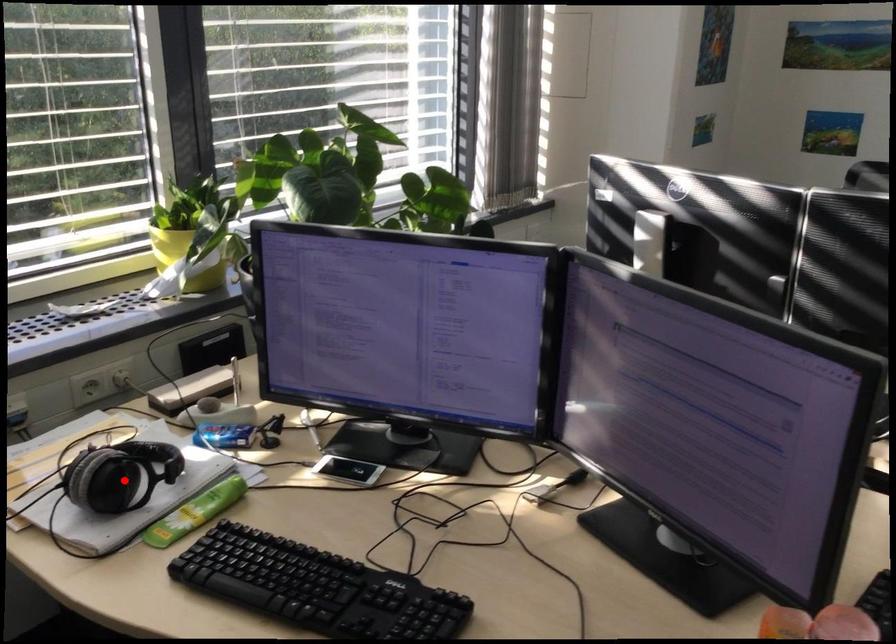
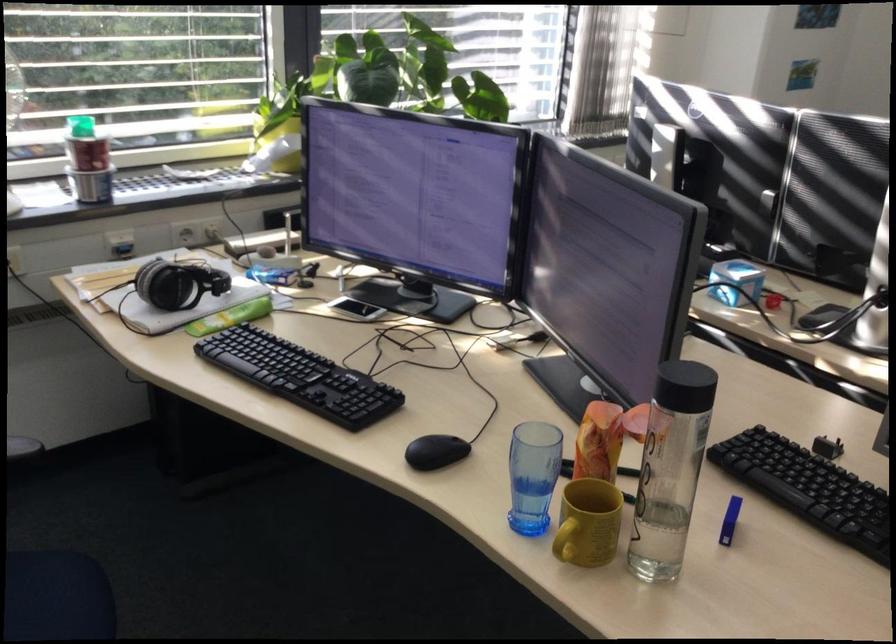
Where in the second image is the point corresponding to the highlighted location from the first image?

(177, 283)